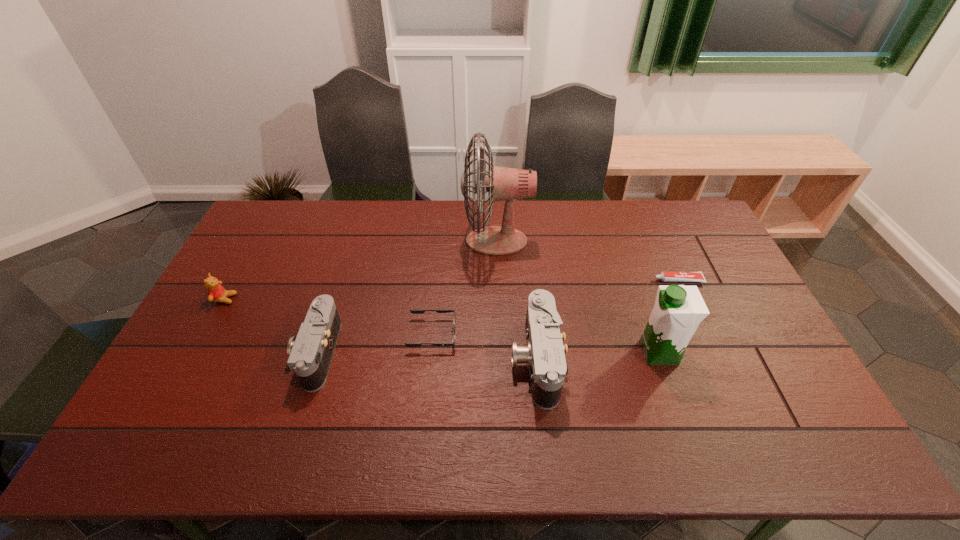
Find the location of `vacant space at the far right corner of the desktop`. vacant space at the far right corner of the desktop is located at coordinates click(x=679, y=221).

Image resolution: width=960 pixels, height=540 pixels. Identify the location of vacant space in between the sixth object from right to left and the right camera. (426, 356).

Find the location of `free space that is in between the fifth nearest object and the toothpaste`. free space that is in between the fifth nearest object and the toothpaste is located at coordinates (451, 289).

At what (x,y) coordinates should I click in order to perform the action: click on free spot between the leftmost object and the second object from right to left. Please return your answer as a coordinate pair (x, y). The image size is (960, 540). Looking at the image, I should click on (442, 326).

Where is `vacant area between the farthest object and the sixth object from left to right`? vacant area between the farthest object and the sixth object from left to right is located at coordinates (578, 296).

This screenshot has height=540, width=960. Find the location of `free area in between the sixth tallest object and the tallest object`. free area in between the sixth tallest object and the tallest object is located at coordinates (465, 287).

Locate an element on the screen. free space between the shorter camera and the taller camera is located at coordinates (426, 356).

Image resolution: width=960 pixels, height=540 pixels. In order to click on free spot between the sixth shortest object and the left camera in this screenshot , I will do `click(489, 353)`.

Where is `empty space that is in between the soya milk and the right camera`? This screenshot has width=960, height=540. empty space that is in between the soya milk and the right camera is located at coordinates (597, 356).

Image resolution: width=960 pixels, height=540 pixels. What are the coordinates of `vacant area that lies between the teddy bear and the left camera` in the screenshot? It's located at (272, 326).